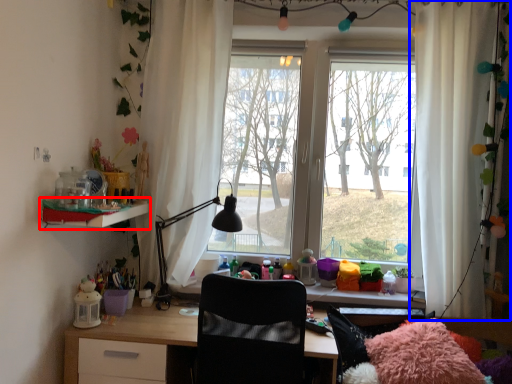
Question: Which point is further to the camera, shelf (highlighted by a red box) or curtain (highlighted by a blue box)?

Choices:
 (A) shelf
 (B) curtain

Answer: (B)